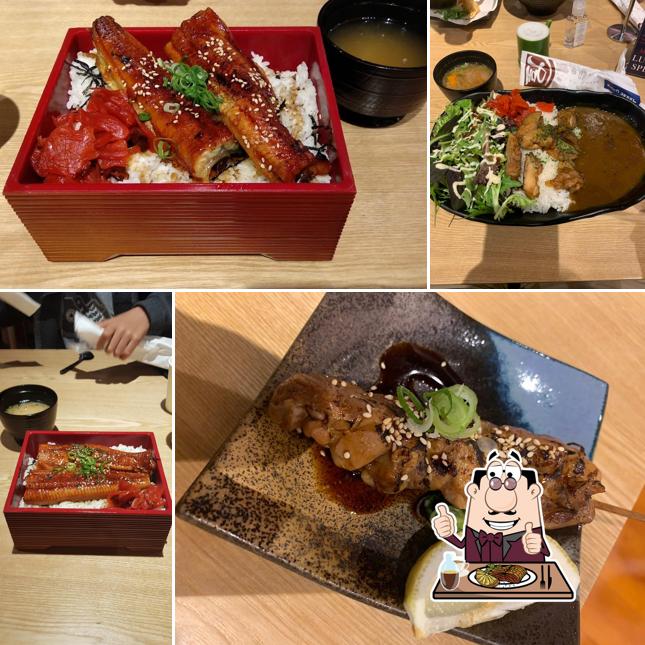
Identify the location of dish. (475, 82).